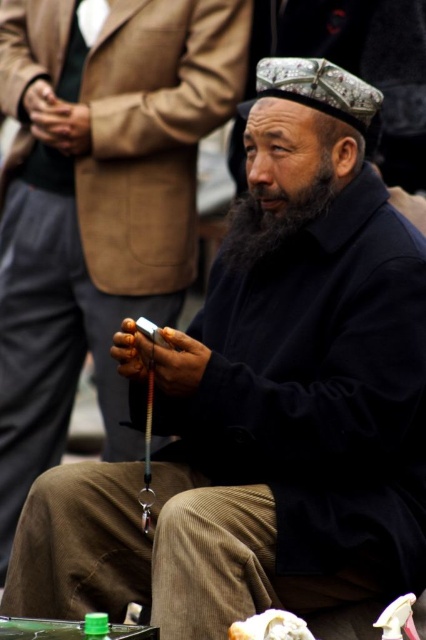
Does black fuzzy beard at center come in front of white fluffy bread at lower center?

No, it is behind white fluffy bread at lower center.

In the scene shown: Is black fuzzy beard at center above white fluffy bread at lower center?

Correct, black fuzzy beard at center is located above white fluffy bread at lower center.

I want to click on black fuzzy beard at center, so click(x=273, y=220).

Locate an element on the screen. black fuzzy beard at center is located at coordinates (273, 220).